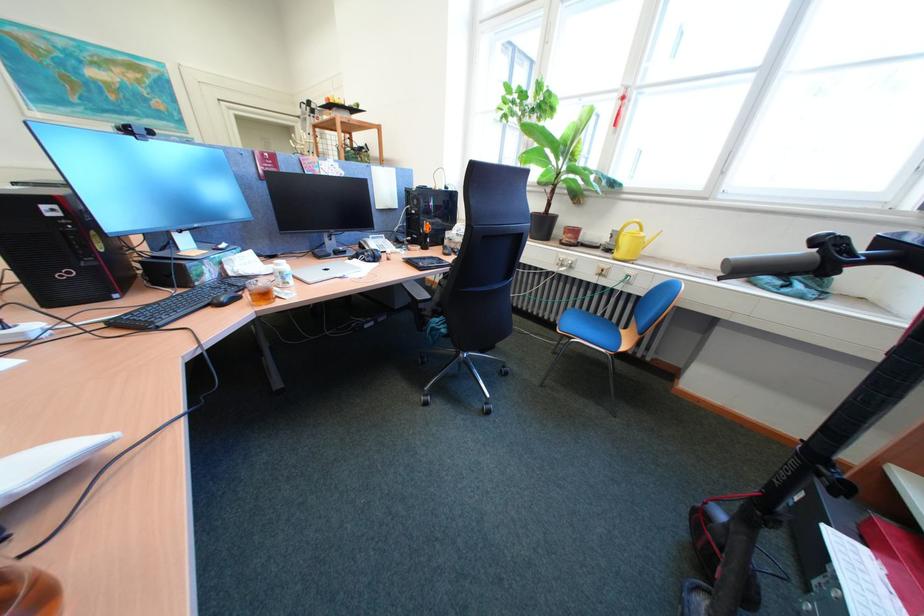
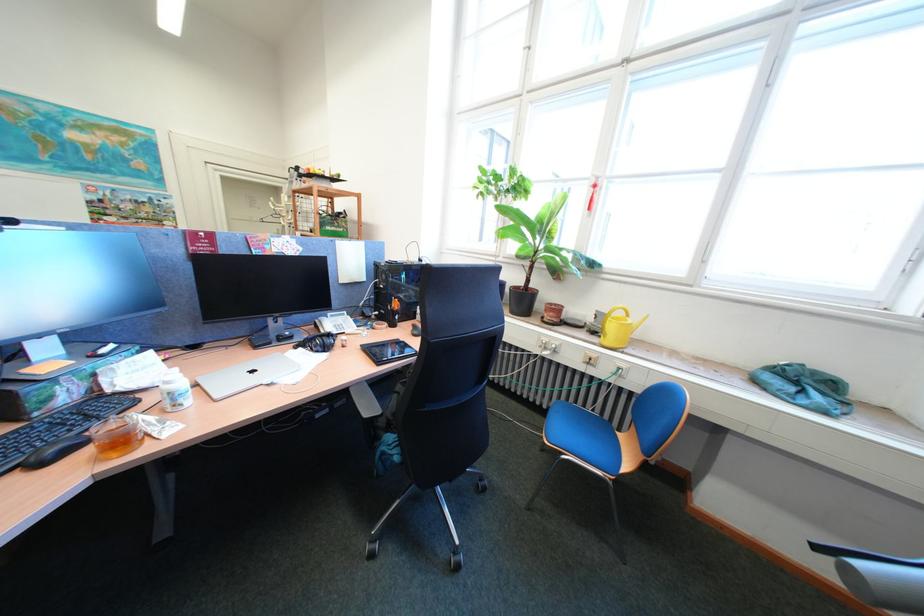
In the second image, find the point that corresponds to the point at 618,241 in the first image.

(602, 321)